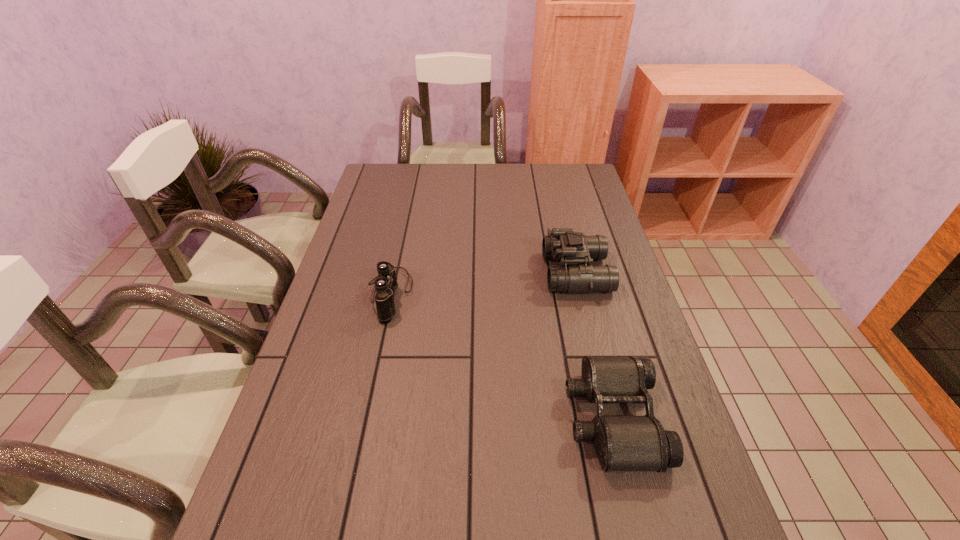
This screenshot has width=960, height=540. In order to click on vacant region between the tallest binoculars and the second tallest object in this screenshot , I will do `click(483, 284)`.

Image resolution: width=960 pixels, height=540 pixels. In order to click on vacant region between the tallest object and the shortest binoculars in this screenshot , I will do (x=594, y=346).

You are a GUI agent. You are given a task and a screenshot of the screen. Output one action in this format:
    pyautogui.click(x=<x>, y=<y>)
    Task: Click on the vacant area that lies between the tallest binoculars and the leftmost binoculars
    
    Given the screenshot: What is the action you would take?
    pyautogui.click(x=483, y=284)

At what (x,y) coordinates should I click in order to perform the action: click on vacant space that is in between the tallest binoculars and the leftmost object. Please return your answer as a coordinate pair (x, y). The width and height of the screenshot is (960, 540). Looking at the image, I should click on (483, 284).

Image resolution: width=960 pixels, height=540 pixels. In order to click on unoccupied position between the second shortest object and the tallest object in this screenshot , I will do `click(483, 284)`.

Find the location of a particular element. This screenshot has height=540, width=960. the closest object to the shortest object is located at coordinates (563, 244).

This screenshot has height=540, width=960. Identify the location of object that ranks as the closest to the tallest object. pyautogui.click(x=622, y=443).

Locate which binoculars ranks second in proximity to the nearest binoculars. Please provide its 2D coordinates. Your answer should be formatted as a tuple, i.e. [(x, y)], where the tuple contains the x and y coordinates of a point satisfying the conditions above.

[(386, 283)]

The height and width of the screenshot is (540, 960). I want to click on binoculars object that ranks as the closest to the tallest binoculars, so click(622, 443).